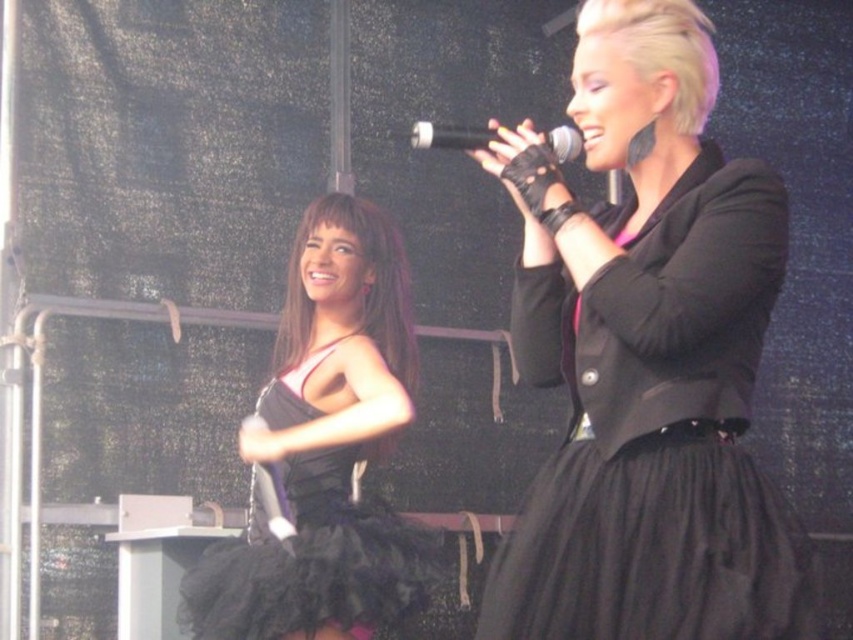
Looking at this image, you are a photographer in the audience and want to capture a photo where the black tulle dress at left and the black matte microphone at upper center are both clearly visible. Based on their positions, will the microphone be visible in front of or behind the dress in the photo?

The black matte microphone at upper center is behind the black tulle dress at left, so in the photo, the microphone will be visible behind the dress.